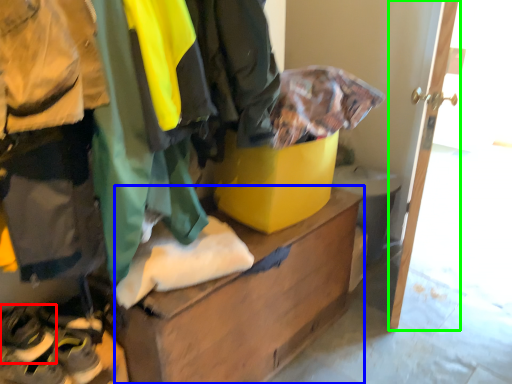
Question: Which object is positioned farthest from footwear (highlighted by a red box)? Select from furniture (highlighted by a blue box) and door (highlighted by a green box).

Choices:
 (A) furniture
 (B) door

Answer: (B)